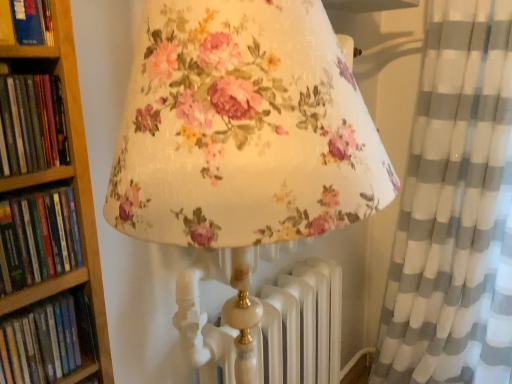
This screenshot has height=384, width=512. In order to click on hardcover book at upper left, which appears as the 4th book when ordered from the bottom in this screenshot , I will do `click(25, 22)`.

Between hardcover book at upper left, which appears as the 4th book when ordered from the bottom, and white/grey striped curtain at right, which one has smaller size?

hardcover book at upper left, which appears as the 4th book when ordered from the bottom, is smaller.

Consider the image. Is hardcover book at upper left, which appears as the 4th book when ordered from the bottom, facing towards white/grey striped curtain at right?

No, hardcover book at upper left, which appears as the 4th book when ordered from the bottom, does not turn towards white/grey striped curtain at right.

Is hardcover book at upper left, which appears as the 4th book when ordered from the bottom, positioned before white/grey striped curtain at right?

Yes, the depth of hardcover book at upper left, which appears as the 4th book when ordered from the bottom, is less than that of white/grey striped curtain at right.

Is point (15, 5) closer to camera compared to point (464, 297)?

That is True.

From a real-world perspective, between hardcover book at left, marked as the third book in a top-to-bottom arrangement, and white/grey striped curtain at right, who is vertically higher?

hardcover book at left, marked as the third book in a top-to-bottom arrangement.

Does hardcover book at left, the second book positioned from the bottom, lie behind white/grey striped curtain at right?

That is False.

Is hardcover book at left, the second book positioned from the bottom, outside of white/grey striped curtain at right?

hardcover book at left, the second book positioned from the bottom, lies outside white/grey striped curtain at right's area.

Considering the positions of points (30, 257) and (459, 191), is point (30, 257) farther from camera compared to point (459, 191)?

No, (30, 257) is closer to viewer.

Do you think green matte book at left, arranged as the second book when viewed from the top, is within hardcover book at left, the second book positioned from the bottom, or outside of it?

The correct answer is: outside.

From a real-world perspective, is green matte book at left, arranged as the second book when viewed from the top, on hardcover book at left, the second book positioned from the bottom?

Yes, from a real-world perspective, green matte book at left, arranged as the second book when viewed from the top, is on top of hardcover book at left, the second book positioned from the bottom.

Based on their sizes in the image, would you say green matte book at left, which ranks as the 3th book in bottom-to-top order, is bigger or smaller than hardcover book at left, the second book positioned from the bottom?

In the image, green matte book at left, which ranks as the 3th book in bottom-to-top order, appears to be larger than hardcover book at left, the second book positioned from the bottom.

From the image's perspective, relative to hardcover book at left, the second book positioned from the bottom, is green matte book at left, which ranks as the 3th book in bottom-to-top order, above or below?

Clearly, from the image's perspective, green matte book at left, which ranks as the 3th book in bottom-to-top order, is above hardcover book at left, the second book positioned from the bottom.

Could you tell me if white/grey striped curtain at right is turned towards hardcover book at left, the 1th book in the bottom-to-top sequence?

Yes.

From a real-world perspective, is white/grey striped curtain at right physically above hardcover book at left, the 1th book in the bottom-to-top sequence?

No.

Between white/grey striped curtain at right and hardcover book at left, the 1th book in the bottom-to-top sequence, which one has more height?

With more height is white/grey striped curtain at right.

Is white/grey striped curtain at right far away from hardcover book at left, arranged as the 4th book when viewed from the top?

Yes, white/grey striped curtain at right and hardcover book at left, arranged as the 4th book when viewed from the top, are quite far apart.

Is hardcover book at left, arranged as the 4th book when viewed from the top, spatially inside hardcover book at left, the second book positioned from the bottom, or outside of it?

hardcover book at left, arranged as the 4th book when viewed from the top, is spatially situated outside hardcover book at left, the second book positioned from the bottom.

Could you measure the distance between hardcover book at left, arranged as the 4th book when viewed from the top, and hardcover book at left, the second book positioned from the bottom?

4.02 inches.

Is hardcover book at left, the 1th book in the bottom-to-top sequence, touching hardcover book at left, marked as the third book in a top-to-bottom arrangement?

hardcover book at left, the 1th book in the bottom-to-top sequence, is not next to hardcover book at left, marked as the third book in a top-to-bottom arrangement, and they're not touching.

Is white/grey striped curtain at right bigger or smaller than hardcover book at left, marked as the third book in a top-to-bottom arrangement?

Clearly, white/grey striped curtain at right is larger in size than hardcover book at left, marked as the third book in a top-to-bottom arrangement.

From the image's perspective, between white/grey striped curtain at right and hardcover book at left, the second book positioned from the bottom, which one is located above?

From the image's view, hardcover book at left, the second book positioned from the bottom, is above.

This screenshot has width=512, height=384. I want to click on curtain on the right of hardcover book at left, the second book positioned from the bottom, so click(454, 207).

Between white/grey striped curtain at right and hardcover book at left, the second book positioned from the bottom, which one is positioned in front?

hardcover book at left, the second book positioned from the bottom, is more forward.

Which of these two, hardcover book at left, arranged as the 4th book when viewed from the top, or hardcover book at upper left, placed as the 1th book when sorted from top to bottom, is smaller?

hardcover book at left, arranged as the 4th book when viewed from the top, is smaller.

Can you see hardcover book at left, arranged as the 4th book when viewed from the top, touching hardcover book at upper left, placed as the 1th book when sorted from top to bottom?

No.

From the hardcover book at left, arranged as the 4th book when viewed from the top, count 3rd books forward and point to it. Please provide its 2D coordinates.

[(25, 22)]

Which of these two, hardcover book at left, the 1th book in the bottom-to-top sequence, or hardcover book at upper left, which appears as the 4th book when ordered from the bottom, stands shorter?

With less height is hardcover book at left, the 1th book in the bottom-to-top sequence.

Where is `curtain that is under the hardcover book at upper left, which appears as the 4th book when ordered from the bottom (from a real-world perspective)`? curtain that is under the hardcover book at upper left, which appears as the 4th book when ordered from the bottom (from a real-world perspective) is located at coordinates click(454, 207).

You are a GUI agent. You are given a task and a screenshot of the screen. Output one action in this format:
    pyautogui.click(x=<x>, y=<y>)
    Task: Click on the 3rd book to the left of the white/grey striped curtain at right, counting from the anchor's position
    The height and width of the screenshot is (384, 512).
    Given the screenshot: What is the action you would take?
    pyautogui.click(x=38, y=238)

Considering their positions, is hardcover book at left, marked as the third book in a top-to-bottom arrangement, positioned further to hardcover book at upper left, placed as the 1th book when sorted from top to bottom, than white/grey striped curtain at right?

Among the two, white/grey striped curtain at right is located further to hardcover book at upper left, placed as the 1th book when sorted from top to bottom.

Looking at the image, which one is located further to hardcover book at upper left, which appears as the 4th book when ordered from the bottom, hardcover book at left, the 1th book in the bottom-to-top sequence, or white/grey striped curtain at right?

white/grey striped curtain at right lies further to hardcover book at upper left, which appears as the 4th book when ordered from the bottom, than the other object.

Based on their spatial positions, is hardcover book at left, the 1th book in the bottom-to-top sequence, or hardcover book at left, marked as the third book in a top-to-bottom arrangement, further from hardcover book at upper left, which appears as the 4th book when ordered from the bottom?

hardcover book at left, the 1th book in the bottom-to-top sequence, is further to hardcover book at upper left, which appears as the 4th book when ordered from the bottom.

Considering their positions, is hardcover book at upper left, placed as the 1th book when sorted from top to bottom, positioned further to hardcover book at left, the second book positioned from the bottom, than hardcover book at left, arranged as the 4th book when viewed from the top?

hardcover book at upper left, placed as the 1th book when sorted from top to bottom, lies further to hardcover book at left, the second book positioned from the bottom, than the other object.

Looking at the image, which one is located closer to green matte book at left, arranged as the second book when viewed from the top, hardcover book at left, the 1th book in the bottom-to-top sequence, or white/grey striped curtain at right?

hardcover book at left, the 1th book in the bottom-to-top sequence, is positioned closer to the anchor green matte book at left, arranged as the second book when viewed from the top.

When comparing their distances from green matte book at left, which ranks as the 3th book in bottom-to-top order, does white/grey striped curtain at right or hardcover book at left, arranged as the 4th book when viewed from the top, seem closer?

Among the two, hardcover book at left, arranged as the 4th book when viewed from the top, is located nearer to green matte book at left, which ranks as the 3th book in bottom-to-top order.

Estimate the real-world distances between objects in this image. Which object is further from white/grey striped curtain at right, hardcover book at upper left, placed as the 1th book when sorted from top to bottom, or hardcover book at left, arranged as the 4th book when viewed from the top?

Based on the image, hardcover book at upper left, placed as the 1th book when sorted from top to bottom, appears to be further to white/grey striped curtain at right.

When comparing their distances from green matte book at left, arranged as the second book when viewed from the top, does hardcover book at left, the second book positioned from the bottom, or hardcover book at upper left, which appears as the 4th book when ordered from the bottom, seem further?

hardcover book at left, the second book positioned from the bottom, lies further to green matte book at left, arranged as the second book when viewed from the top, than the other object.

Find the location of `book that lies between green matte book at left, arranged as the second book when viewed from the top, and hardcover book at left, the 1th book in the bottom-to-top sequence, from top to bottom`. book that lies between green matte book at left, arranged as the second book when viewed from the top, and hardcover book at left, the 1th book in the bottom-to-top sequence, from top to bottom is located at coordinates (38, 238).

This screenshot has width=512, height=384. Identify the location of book between hardcover book at upper left, placed as the 1th book when sorted from top to bottom, and hardcover book at left, marked as the third book in a top-to-bottom arrangement, from top to bottom. (32, 124).

Locate an element on the screen. This screenshot has width=512, height=384. book between green matte book at left, arranged as the second book when viewed from the top, and white/grey striped curtain at right, in the horizontal direction is located at coordinates (25, 22).